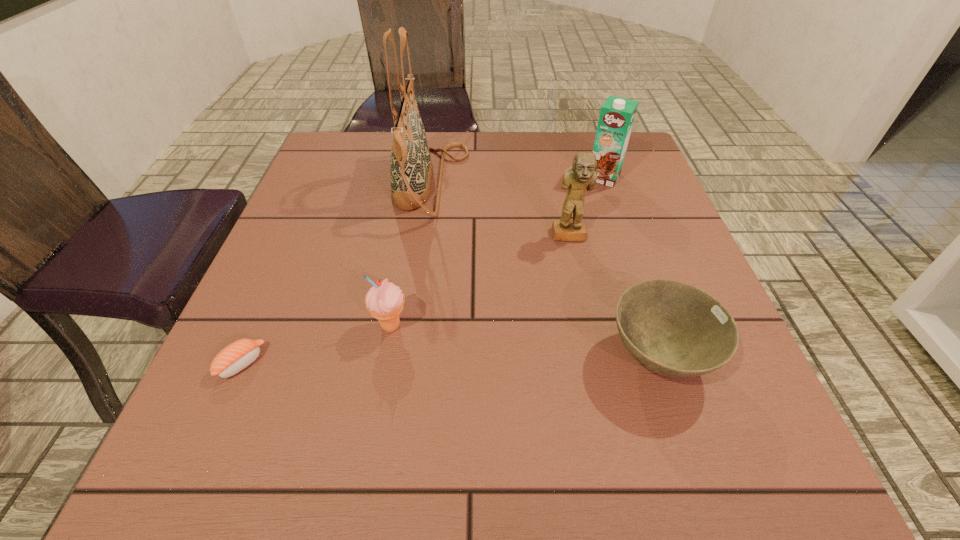
The height and width of the screenshot is (540, 960). Find the location of `vacant region between the figurine and the shortest object`. vacant region between the figurine and the shortest object is located at coordinates (405, 300).

Where is `vacant point located between the carton and the icecream`? Image resolution: width=960 pixels, height=540 pixels. vacant point located between the carton and the icecream is located at coordinates pos(497,252).

This screenshot has width=960, height=540. Find the location of `free space between the icecream and the figurine`. free space between the icecream and the figurine is located at coordinates (480, 281).

At what (x,y) coordinates should I click in order to perform the action: click on free spot between the carton and the handbag. Please return your answer as a coordinate pair (x, y). Looking at the image, I should click on (517, 180).

Select which object appears as the fourth closest to the carton. Please provide its 2D coordinates. Your answer should be formatted as a tuple, i.e. [(x, y)], where the tuple contains the x and y coordinates of a point satisfying the conditions above.

[(385, 301)]

This screenshot has width=960, height=540. I want to click on object that stands as the fifth closest to the figurine, so (x=235, y=357).

The height and width of the screenshot is (540, 960). In order to click on blank space that satisfies the following two spatial constraints: 1. on the back side of the second shortest object; 2. on the left side of the shortest object in this screenshot , I will do `click(245, 356)`.

Locate an element on the screen. The width and height of the screenshot is (960, 540). free space that satisfies the following two spatial constraints: 1. on the front side of the icecream; 2. on the right side of the second shortest object is located at coordinates (386, 356).

Find the location of a particular element. This screenshot has height=540, width=960. vacant space that satisfies the following two spatial constraints: 1. on the back side of the carton; 2. on the right side of the fifth tallest object is located at coordinates (599, 177).